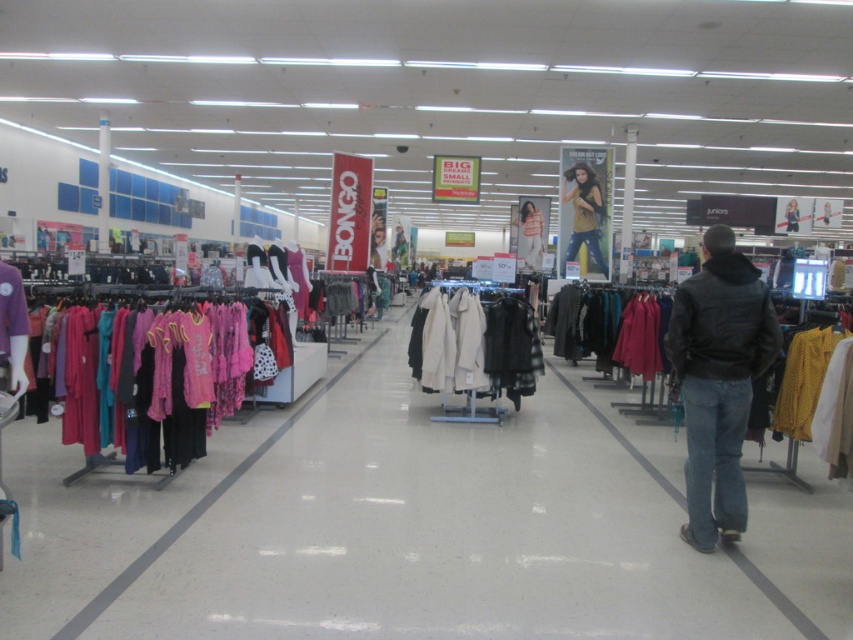
Is velvet maroon coat at center closer to the viewer compared to matte yellow shirt at center?

That is True.

Does point (595, 301) come behind point (589, 218)?

That is False.

I want to click on velvet maroon coat at center, so click(607, 328).

Which is above, black leather jacket at right or velvet maroon coat at center?

Positioned higher is velvet maroon coat at center.

Is black leather jacket at right below velvet maroon coat at center?

Correct, black leather jacket at right is located below velvet maroon coat at center.

Is point (706, 296) positioned before point (648, 340)?

Yes.

Identify the location of black leather jacket at right. (718, 380).

Which is behind, point (666, 337) or point (570, 259)?

The point (570, 259) is behind.

Is point (703, 236) in front of point (584, 192)?

No, (703, 236) is behind (584, 192).

Where is `black leather jacket at right`? The width and height of the screenshot is (853, 640). black leather jacket at right is located at coordinates (718, 380).